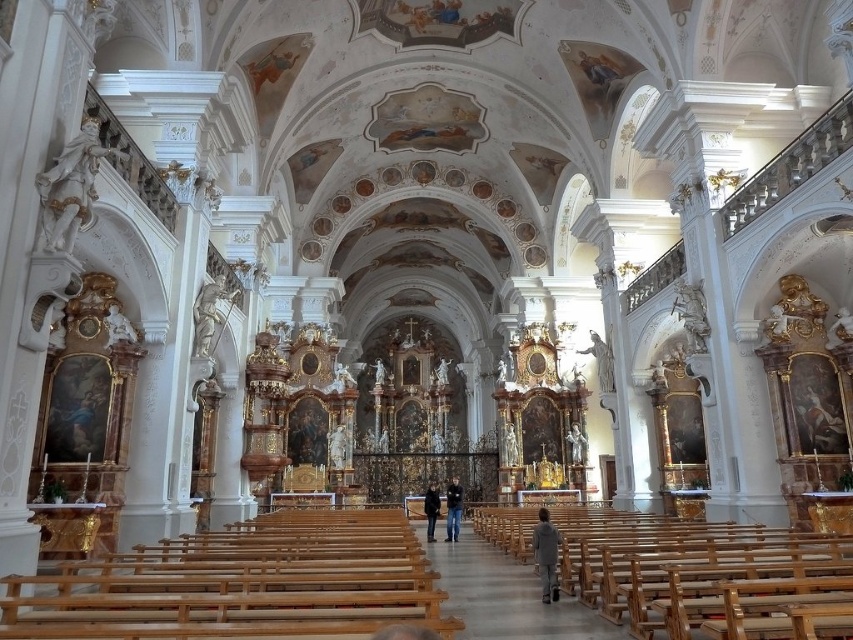
Question: Is gray fabric jacket at lower center above black leather jacket at center?

Choices:
 (A) yes
 (B) no

Answer: (A)

Question: Does dark blue jeans at center have a smaller size compared to black leather jacket at center?

Choices:
 (A) no
 (B) yes

Answer: (A)

Question: Which object is farther from the camera taking this photo?

Choices:
 (A) dark blue jeans at center
 (B) gray fabric jacket at lower center
 (C) black leather jacket at center

Answer: (A)

Question: Is gray fabric jacket at lower center wider than black leather jacket at center?

Choices:
 (A) yes
 (B) no

Answer: (B)

Question: Among these objects, which one is nearest to the camera?

Choices:
 (A) black leather jacket at center
 (B) gray fabric jacket at lower center
 (C) dark blue jeans at center

Answer: (B)

Question: Which object appears farthest from the camera in this image?

Choices:
 (A) black leather jacket at center
 (B) dark blue jeans at center

Answer: (B)